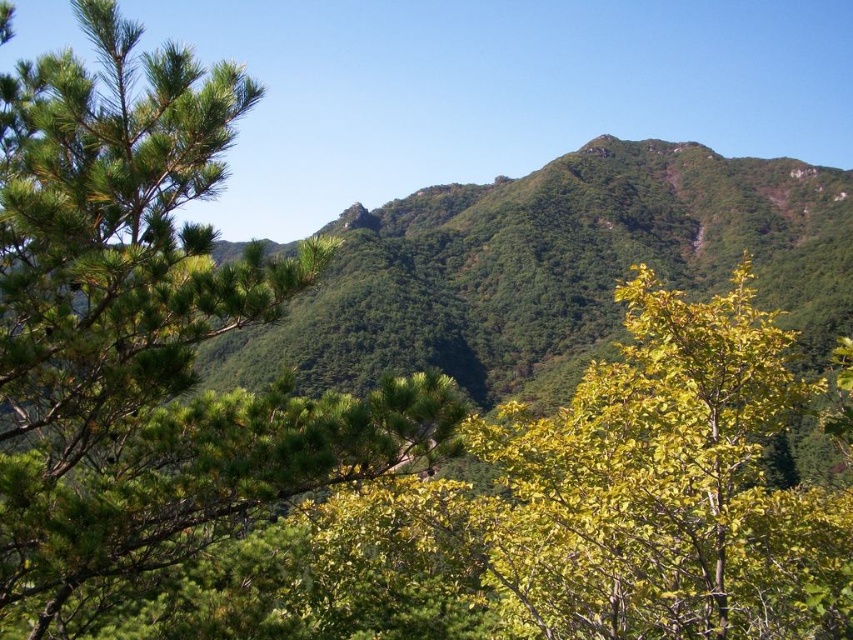
You are planning to plant a new tree that needs at least 10 meters of space between it and any existing trees. You see the green matte tree at left and the green leafy tree at center. Can you plant the new tree between them without violating the spacing requirement?

The distance between the green matte tree at left and the green leafy tree at center is 11.36 meters, which is more than the required 10 meters. Therefore, you can plant the new tree between them as there is sufficient space.

You are a hiker standing in the forest looking at the green matte tree at left and the green leafy tree at center. Which tree is closer to you?

The green matte tree at left is closer because it is positioned over the green leafy tree at center, indicating it is in front.